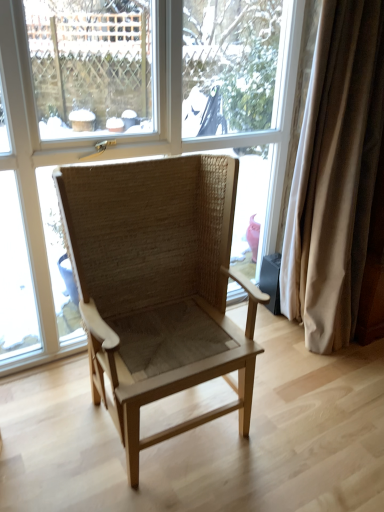
Image resolution: width=384 pixels, height=512 pixels. What are the coordinates of `vacant area to the left of beige fabric curtain at right` in the screenshot? It's located at [267, 338].